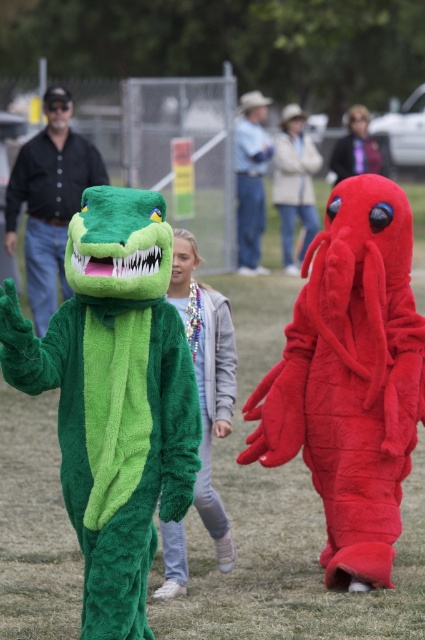
Can you confirm if velvet red octopus at center is wider than green plush crocodile at left?

Incorrect, velvet red octopus at center's width does not surpass green plush crocodile at left's.

Find the location of a particular element. This screenshot has width=425, height=640. velvet red octopus at center is located at coordinates (115, 397).

Consider the image. Does denim jacket at center appear on the left side of blue denim jeans at center?

No, denim jacket at center is not to the left of blue denim jeans at center.

Does point (300, 141) come behind point (255, 161)?

That is True.

Is point (299, 198) more distant than point (235, 160)?

That is True.

Find the location of a particular element. The width and height of the screenshot is (425, 640). denim jacket at center is located at coordinates (294, 182).

Is point (371, 573) behind point (374, 161)?

That is False.

Is velvet red octopus at right further to camera compared to smooth purple jacket at center?

No, velvet red octopus at right is closer to the viewer.

At what (x,y) coordinates should I click in order to perform the action: click on velvet red octopus at right. Please return your answer as a coordinate pair (x, y). This screenshot has width=425, height=640. Looking at the image, I should click on (351, 378).

Where is `velvet red octopus at right`? velvet red octopus at right is located at coordinates (351, 378).